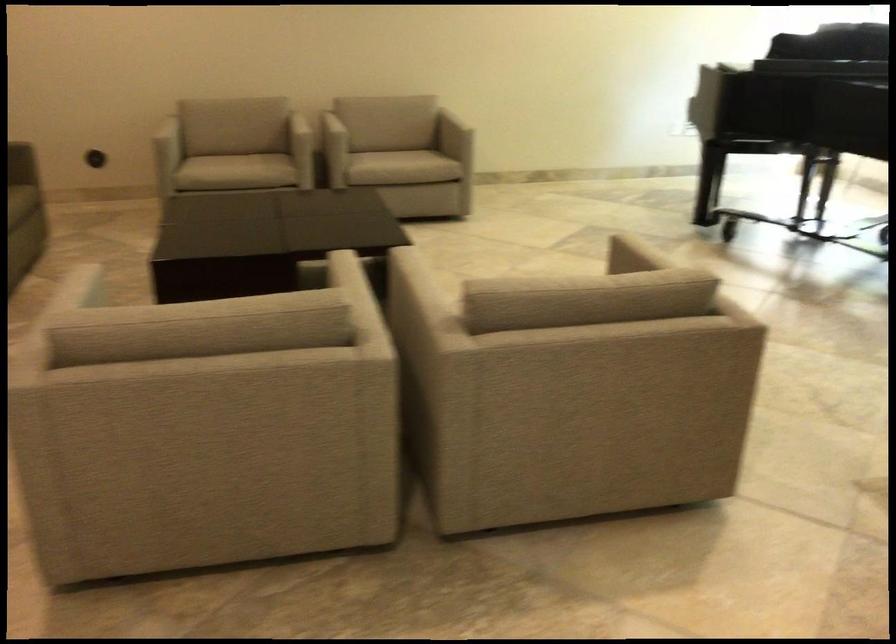
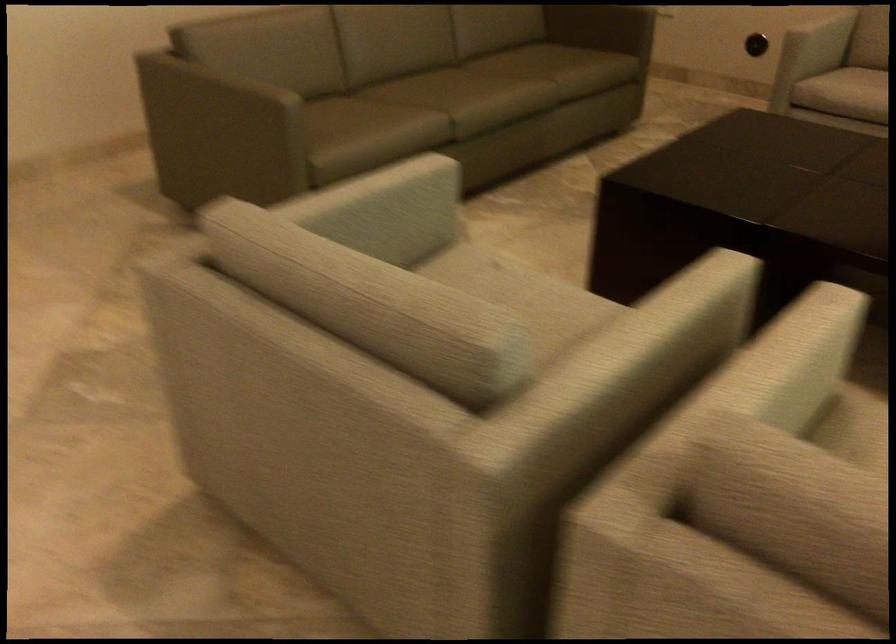
The point at (173, 134) is marked in the first image. Where is the corresponding point in the second image?

(821, 35)